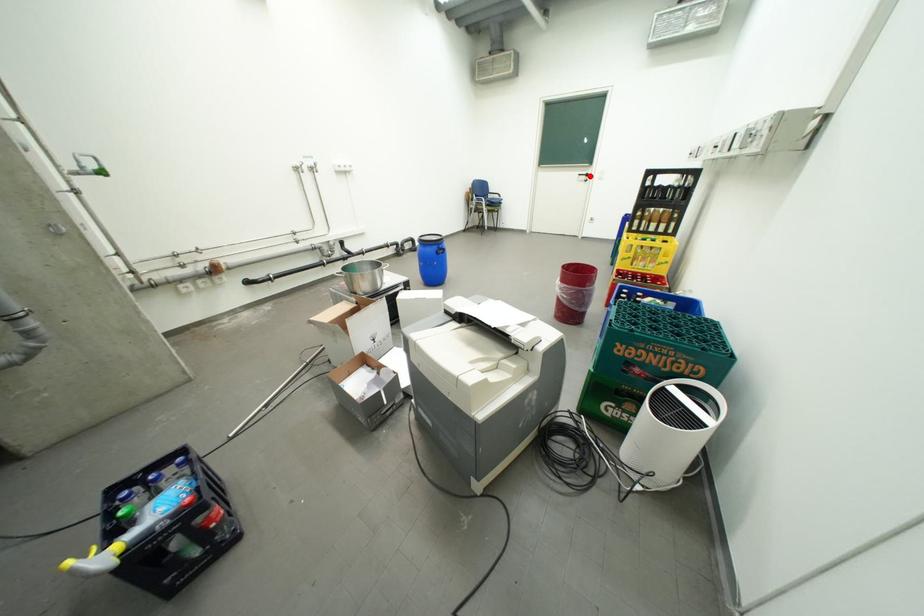
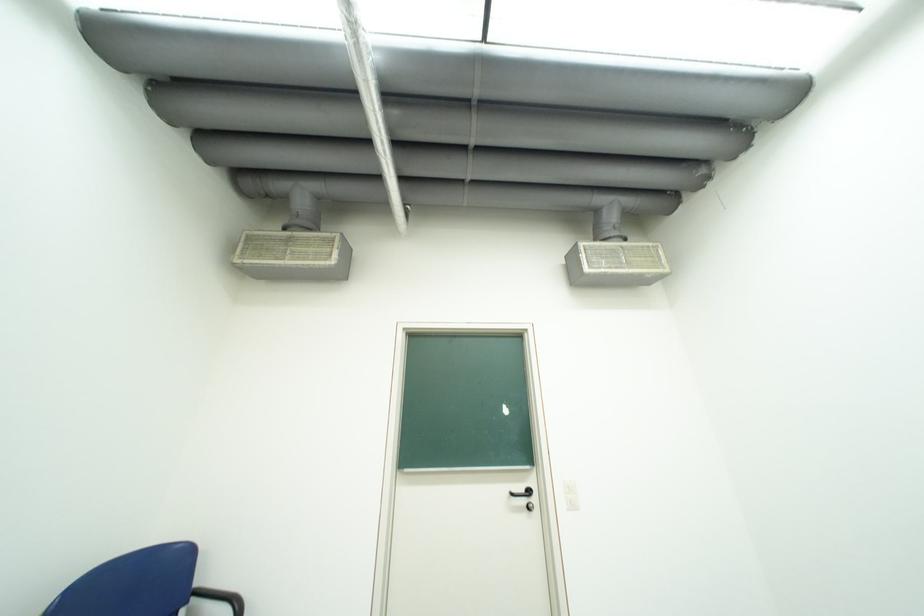
Where in the second image is the point corresponding to the highlighted location from the first image?

(523, 495)